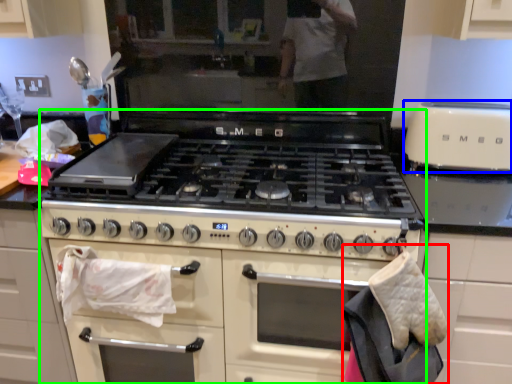
Question: Estimate the real-world distances between objects in this image. Which object is closer to material (highlighted by a red box), kitchen appliance (highlighted by a blue box) or appliance (highlighted by a green box)?

Choices:
 (A) kitchen appliance
 (B) appliance

Answer: (B)